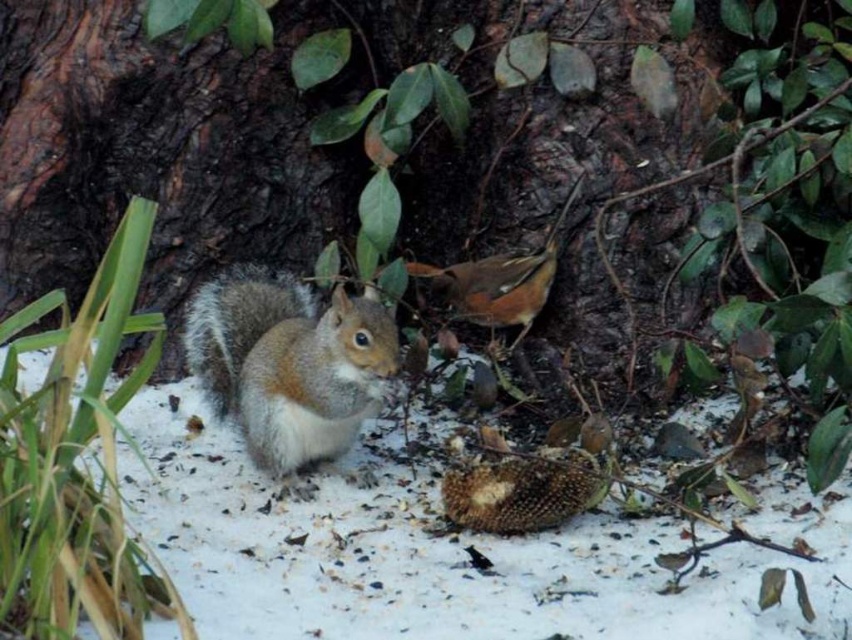
Which is above, white fluffy snow at center or gray-furred squirrel at center?

gray-furred squirrel at center

Does white fluffy snow at center have a lesser width compared to gray-furred squirrel at center?

No.

Find the location of a particular element. white fluffy snow at center is located at coordinates (453, 554).

Does gray-furred squirrel at center appear on the right side of brown speckled bird at center?

In fact, gray-furred squirrel at center is to the left of brown speckled bird at center.

Between point (378, 307) and point (528, 280), which one is positioned behind?

The point (528, 280) is behind.

From the picture: Who is more distant from viewer, (245, 356) or (521, 321)?

Point (521, 321)

You are a GUI agent. You are given a task and a screenshot of the screen. Output one action in this format:
    pyautogui.click(x=<x>, y=<y>)
    Task: Click on the gray-furred squirrel at center
    
    Given the screenshot: What is the action you would take?
    pyautogui.click(x=291, y=368)

Measure the distance from white fluffy snow at center to brown speckled bird at center.

The distance of white fluffy snow at center from brown speckled bird at center is 24.52 inches.

Can you confirm if white fluffy snow at center is taller than brown speckled bird at center?

No, white fluffy snow at center is not taller than brown speckled bird at center.

Image resolution: width=852 pixels, height=640 pixels. I want to click on white fluffy snow at center, so click(453, 554).